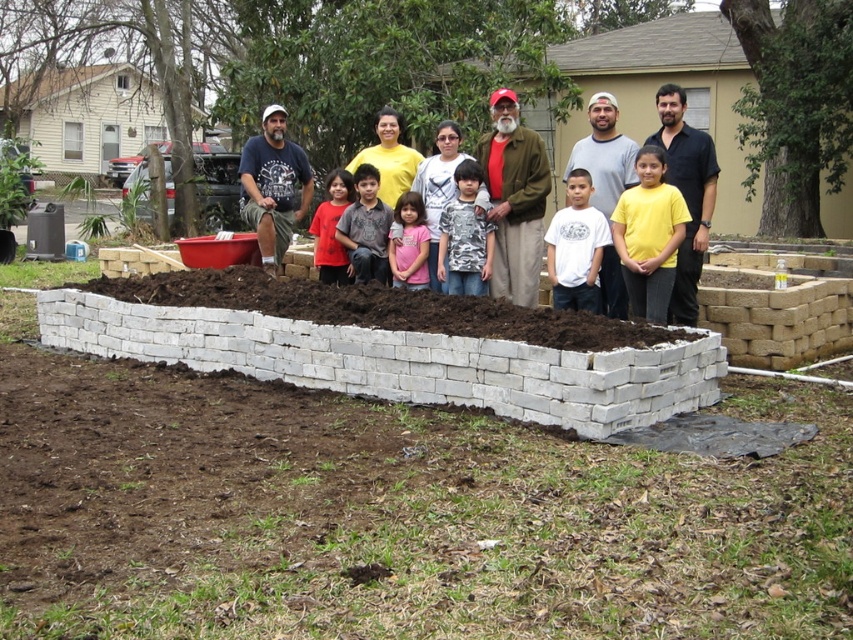
Question: Considering the real-world distances, which object is farthest from the white cotton shirt at center?

Choices:
 (A) camouflage shirt at center
 (B) yellow matte shirt at center

Answer: (A)

Question: Among these objects, which one is farthest from the camera?

Choices:
 (A) dark brown soil at center
 (B) dark brown shirt at center

Answer: (B)

Question: Does yellow matte shirt at center lie in front of camouflage shirt at center?

Choices:
 (A) yes
 (B) no

Answer: (A)

Question: Can you confirm if matte black shirt at center is bigger than dark brown shirt at center?

Choices:
 (A) no
 (B) yes

Answer: (B)

Question: In this image, where is yellow matte shirt at center located relative to white cotton shirt at center?

Choices:
 (A) below
 (B) above

Answer: (A)

Question: Which object is farther from the camera taking this photo?

Choices:
 (A) dark brown shirt at center
 (B) matte red shirt at center

Answer: (B)